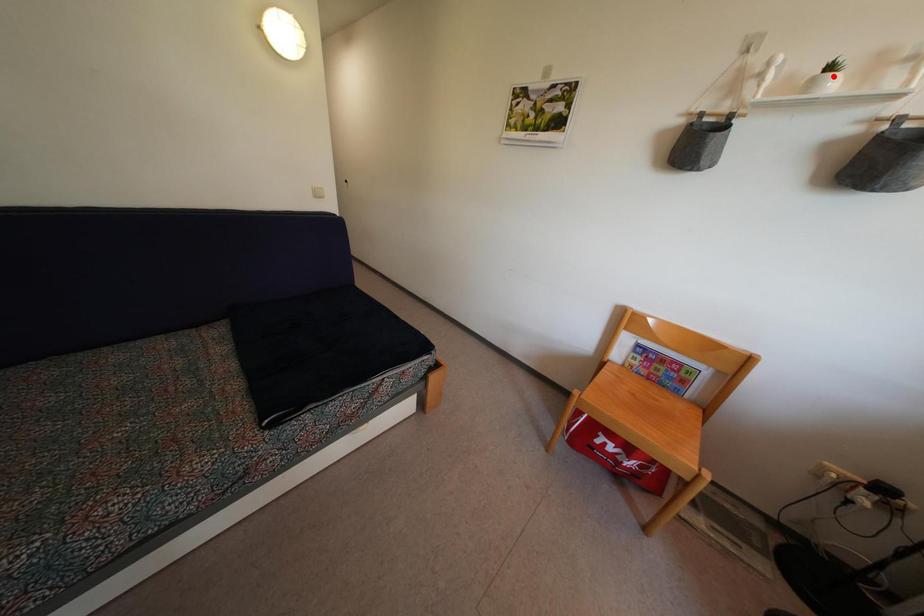
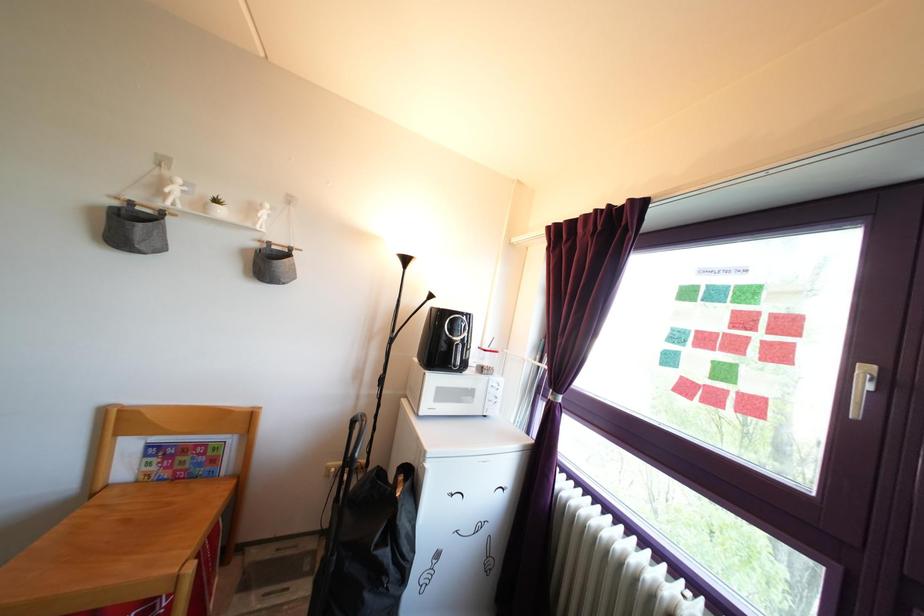
The point at the highlighted location is marked in the first image. Where is the corresponding point in the second image?

(219, 209)